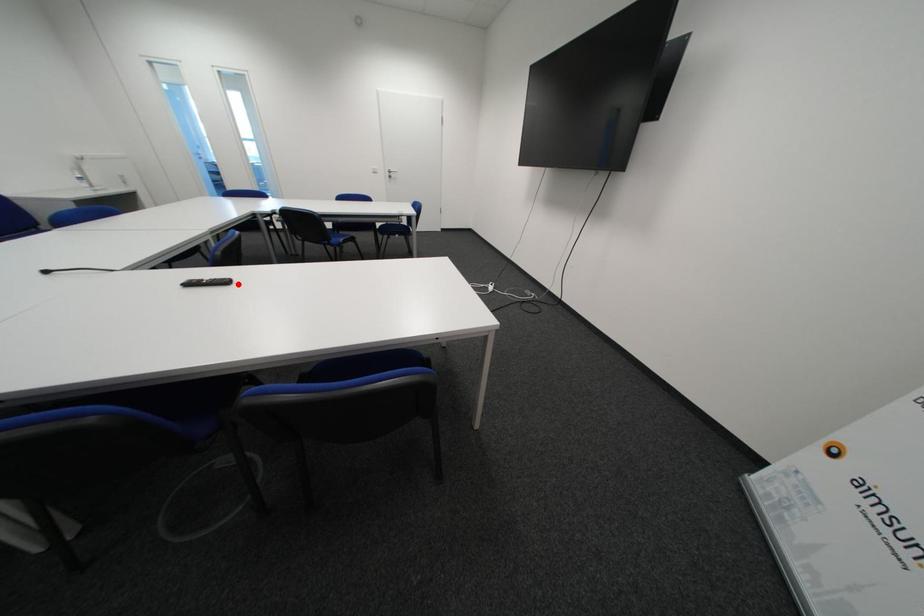
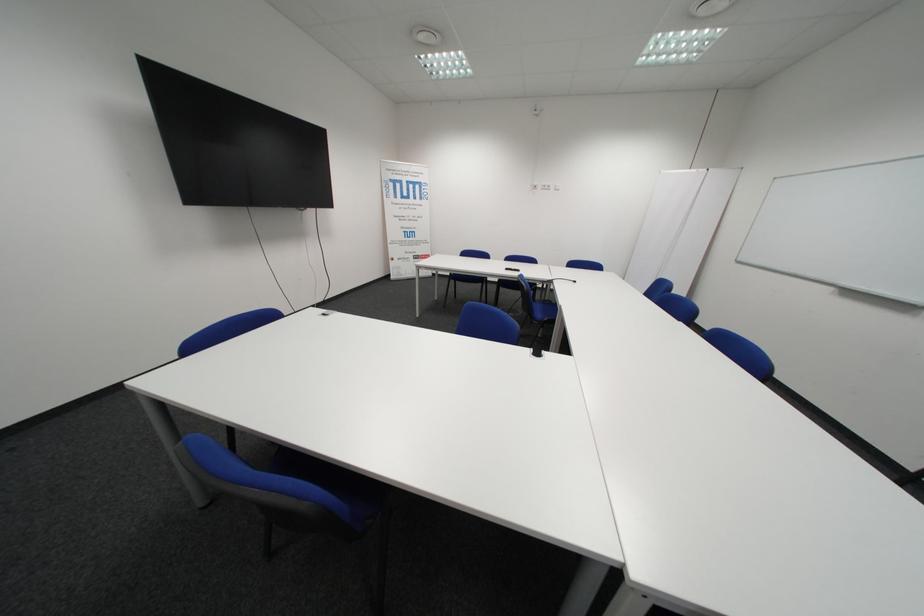
Question: I am providing you with two images of the same scene from different viewpoints. Given a red point in image1, look at the same physical point in image2. Is it:

Choices:
 (A) Closer to the viewpoint
 (B) Farther from the viewpoint

Answer: (A)